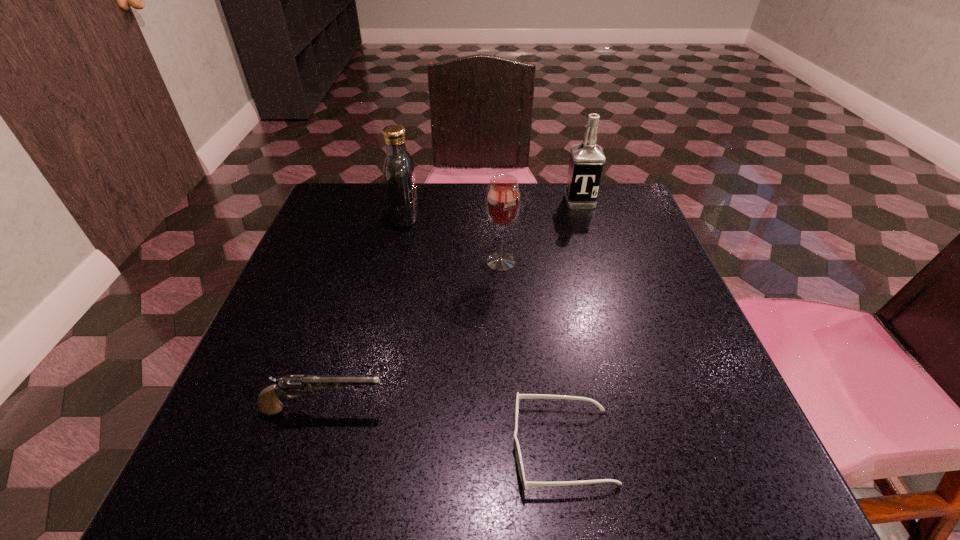
Find the location of `free spot between the wineglass and the fourth tallest object`. free spot between the wineglass and the fourth tallest object is located at coordinates (412, 335).

I want to click on empty location between the gun and the sunglasses, so click(443, 428).

Where is `free space between the gun and the right vodka`? free space between the gun and the right vodka is located at coordinates (451, 305).

Choose which object is the second nearest neighbor to the rightmost object. Please provide its 2D coordinates. Your answer should be formatted as a tuple, i.e. [(x, y)], where the tuple contains the x and y coordinates of a point satisfying the conditions above.

[(399, 175)]

Identify which object is the nearest to the rightmost object. Please provide its 2D coordinates. Your answer should be formatted as a tuple, i.e. [(x, y)], where the tuple contains the x and y coordinates of a point satisfying the conditions above.

[(503, 199)]

Where is `free space that satisfies the following two spatial constraints: 1. on the front side of the third farthest object; 2. aiming along the barrel of the second shortest object`? The height and width of the screenshot is (540, 960). free space that satisfies the following two spatial constraints: 1. on the front side of the third farthest object; 2. aiming along the barrel of the second shortest object is located at coordinates (509, 409).

What are the coordinates of `free space that satisfies the following two spatial constraints: 1. on the front label of the right vodka; 2. with the lenses of the sunglasses facing outward` in the screenshot? It's located at (656, 447).

I want to click on vacant region that satisfies the following two spatial constraints: 1. on the back side of the wineglass; 2. on the front-facing side of the left vodka, so click(x=498, y=217).

Find the location of a particular element. Image resolution: width=960 pixels, height=540 pixels. free space that satisfies the following two spatial constraints: 1. on the front label of the right vodka; 2. on the front-facing side of the left vodka is located at coordinates (585, 217).

What are the coordinates of `free location that satisfies the following two spatial constraints: 1. on the front-facing side of the left vodka; 2. on the left side of the third farthest object` in the screenshot? It's located at (396, 262).